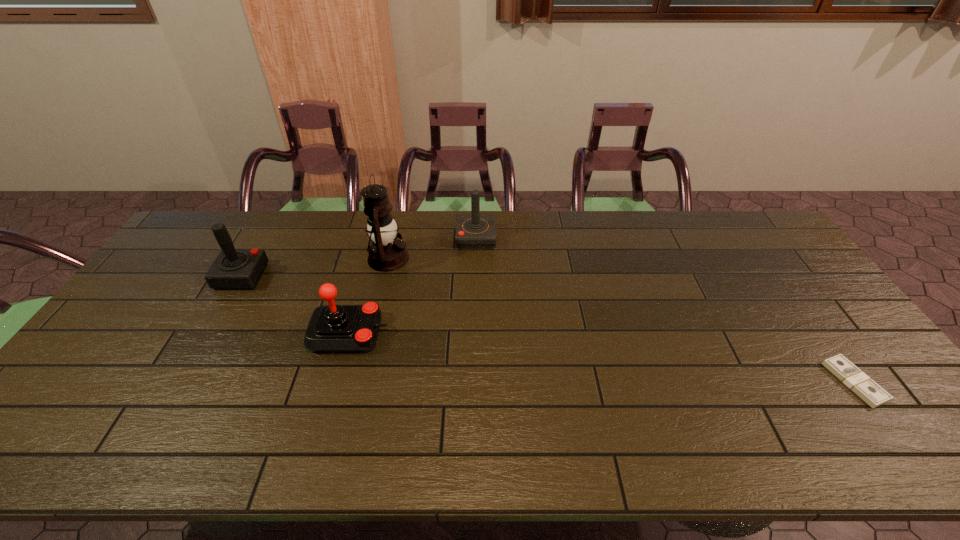
Find the location of `vacant area that satisfies the following two spatial constraints: 1. on the base of the second nearest joystick; 2. on the back side of the shortest object`. vacant area that satisfies the following two spatial constraints: 1. on the base of the second nearest joystick; 2. on the back side of the shortest object is located at coordinates (180, 382).